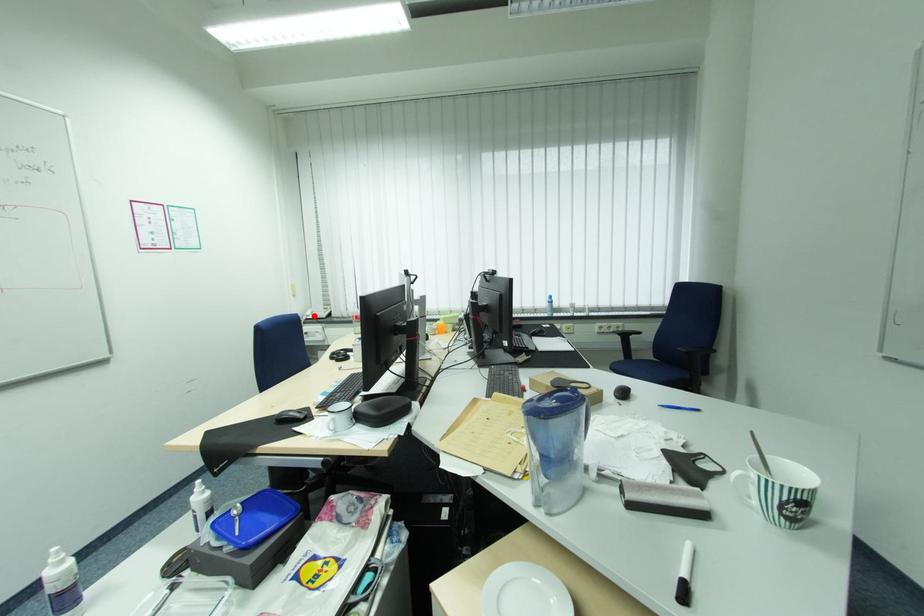
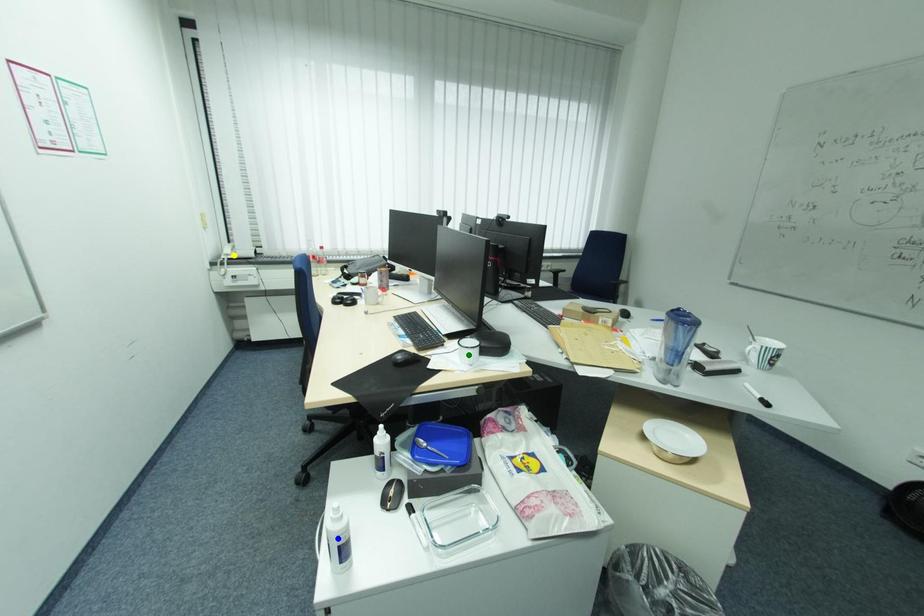
Question: I am providing you with two images of the same scene from different viewpoints. A red point is marked on the first image. You are given multiple points on the second image. Which mark in image 2 goes with the point in image 1?

Choices:
 (A) yellow point
 (B) green point
 (C) blue point

Answer: (A)